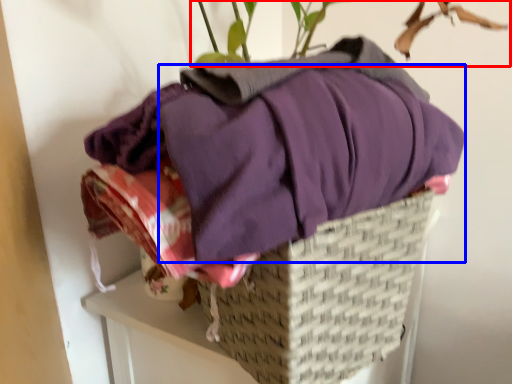
Question: Which point is further to the camera, houseplant (highlighted by a red box) or clothing (highlighted by a blue box)?

Choices:
 (A) houseplant
 (B) clothing

Answer: (B)